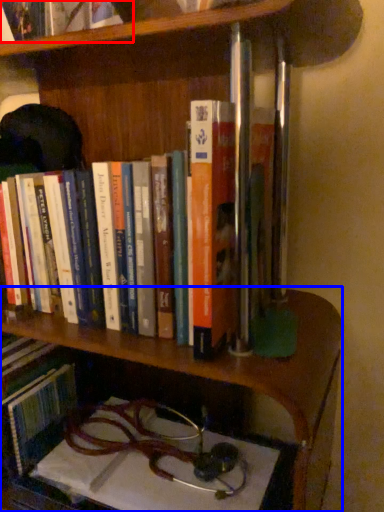
Question: Among these objects, which one is nearest to the camera, book (highlighted by a red box) or shelf (highlighted by a blue box)?

Choices:
 (A) book
 (B) shelf

Answer: (A)